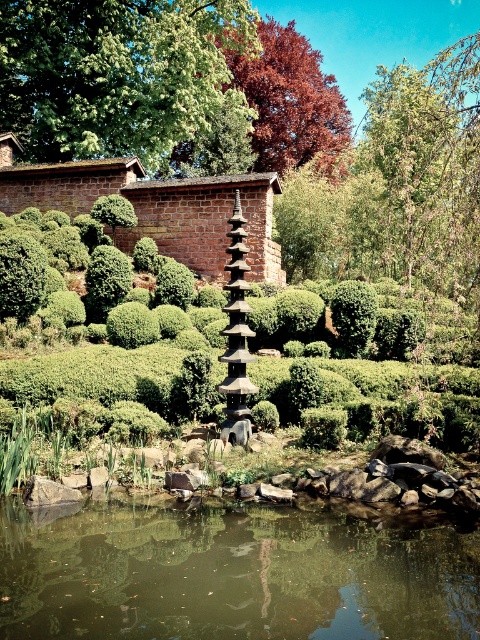
Can you confirm if brown reflective water at center is positioned to the left of shiny red leaves at upper center?

Yes, brown reflective water at center is to the left of shiny red leaves at upper center.

Is brown reflective water at center above shiny red leaves at upper center?

Incorrect, brown reflective water at center is not positioned above shiny red leaves at upper center.

This screenshot has width=480, height=640. I want to click on brown reflective water at center, so click(233, 573).

Based on the photo, which is more to the right, green leafy tree at upper center or shiny red leaves at upper center?

Positioned to the right is shiny red leaves at upper center.

Who is more distant from viewer, (35, 148) or (233, 84)?

Point (233, 84)

Identify the location of green leafy tree at upper center. (115, 72).

Does point (398, 577) come closer to viewer compared to point (119, 36)?

Yes, it is in front of point (119, 36).

Identify the location of brown reflective water at center. The width and height of the screenshot is (480, 640). (233, 573).